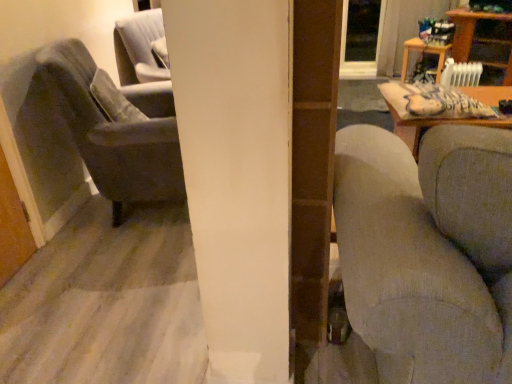
Question: Is wooden table at upper right, the second table viewed from the left, aimed at wooden table at upper right, acting as the 1th table starting from the left?

Choices:
 (A) yes
 (B) no

Answer: (B)

Question: Does wooden table at upper right, placed as the first table when sorted from right to left, touch wooden table at upper right, acting as the 1th table starting from the left?

Choices:
 (A) yes
 (B) no

Answer: (B)

Question: Does wooden table at upper right, placed as the first table when sorted from right to left, have a smaller size compared to wooden table at upper right, the second table when ordered from right to left?

Choices:
 (A) yes
 (B) no

Answer: (B)

Question: From a real-world perspective, is wooden table at upper right, placed as the first table when sorted from right to left, under wooden table at upper right, acting as the 1th table starting from the left?

Choices:
 (A) yes
 (B) no

Answer: (B)

Question: From the image's perspective, is wooden table at upper right, the second table viewed from the left, under wooden table at upper right, the second table when ordered from right to left?

Choices:
 (A) yes
 (B) no

Answer: (B)

Question: Is velvet gray armchair at left wider or thinner than textured gray couch at right?

Choices:
 (A) wide
 (B) thin

Answer: (B)

Question: From the image's perspective, is velvet gray armchair at left above or below textured gray couch at right?

Choices:
 (A) above
 (B) below

Answer: (A)

Question: Is velvet gray armchair at left bigger or smaller than textured gray couch at right?

Choices:
 (A) small
 (B) big

Answer: (A)

Question: Considering the positions of velvet gray armchair at left and textured gray couch at right in the image, is velvet gray armchair at left taller or shorter than textured gray couch at right?

Choices:
 (A) short
 (B) tall

Answer: (A)

Question: Based on their sizes in the image, would you say wooden table at upper right, placed as the first table when sorted from right to left, is bigger or smaller than velvet gray armchair at left?

Choices:
 (A) small
 (B) big

Answer: (A)

Question: Does point (504, 74) appear closer or farther from the camera than point (138, 167)?

Choices:
 (A) closer
 (B) farther

Answer: (B)

Question: Choose the correct answer: Is wooden table at upper right, placed as the first table when sorted from right to left, inside velvet gray armchair at left or outside it?

Choices:
 (A) outside
 (B) inside

Answer: (A)

Question: Would you say wooden table at upper right, the second table viewed from the left, is to the left or to the right of velvet gray armchair at left in the picture?

Choices:
 (A) right
 (B) left

Answer: (A)

Question: Would you say wooden table at upper right, placed as the first table when sorted from right to left, is inside or outside wooden table at upper right, the second table when ordered from right to left?

Choices:
 (A) inside
 (B) outside

Answer: (B)

Question: Would you say wooden table at upper right, the second table viewed from the left, is to the left or to the right of wooden table at upper right, the second table when ordered from right to left, in the picture?

Choices:
 (A) right
 (B) left

Answer: (A)